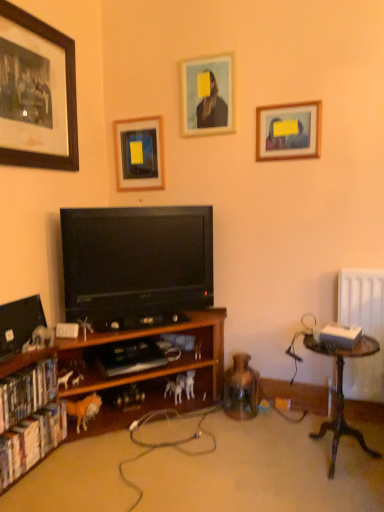
Locate an element on the screen. The width and height of the screenshot is (384, 512). free spot below wooden bookshelf at left (from a real-world perspective) is located at coordinates (123, 458).